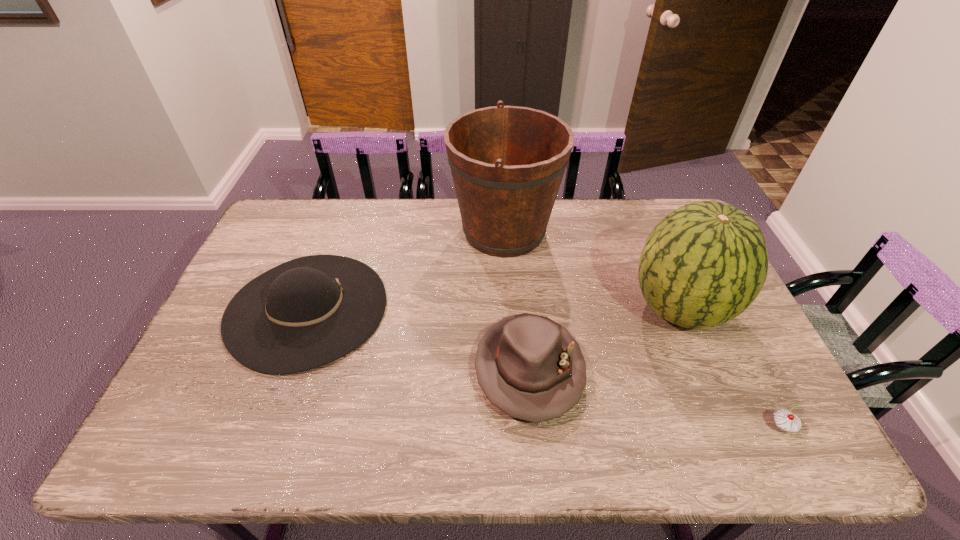
Where is `free region at the near left corner of the desktop`? free region at the near left corner of the desktop is located at coordinates (194, 424).

This screenshot has height=540, width=960. Identify the location of vacant space that is in between the sombrero and the bucket. (406, 270).

Where is `free space that is in between the bucket and the leftmost object`? free space that is in between the bucket and the leftmost object is located at coordinates (406, 270).

You are a GUI agent. You are given a task and a screenshot of the screen. Output one action in this format:
    pyautogui.click(x=<x>, y=<y>)
    Task: Click on the free area in between the cupcake and the hat
    Image resolution: width=960 pixels, height=540 pixels.
    Given the screenshot: What is the action you would take?
    pyautogui.click(x=655, y=398)

At what (x,y) coordinates should I click in order to perform the action: click on vacant space in between the bucket and the leftmost object. Please return your answer as a coordinate pair (x, y). The width and height of the screenshot is (960, 540). Looking at the image, I should click on pyautogui.click(x=406, y=270).

Locate an element on the screen. This screenshot has width=960, height=540. free spot between the hat and the shortest object is located at coordinates (655, 398).

Find the location of a particular element. free space between the bucket and the hat is located at coordinates (516, 300).

At what (x,y) coordinates should I click in order to perform the action: click on free area in between the leftmost object and the bucket. Please return your answer as a coordinate pair (x, y). The width and height of the screenshot is (960, 540). Looking at the image, I should click on (406, 270).

Identify the location of vacant area that lies between the watermelon and the bucket. (592, 269).

Where is `the closest object to the sombrero`? The image size is (960, 540). the closest object to the sombrero is located at coordinates (507, 162).